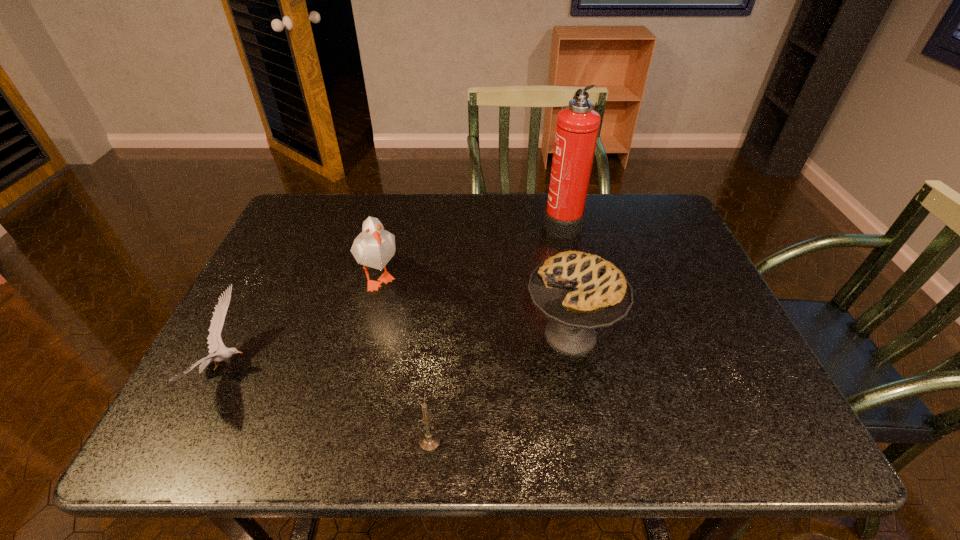
Locate an element on the screen. The width and height of the screenshot is (960, 540). free area in between the shorter gull and the farthest object is located at coordinates (394, 295).

At what (x,y) coordinates should I click in order to perform the action: click on blank region between the tallest object and the taller gull. Please return your answer as a coordinate pair (x, y). Image resolution: width=960 pixels, height=540 pixels. Looking at the image, I should click on (470, 249).

Locate an element on the screen. Image resolution: width=960 pixels, height=540 pixels. free space that is in between the third tallest object and the shorter gull is located at coordinates (398, 352).

The image size is (960, 540). What are the coordinates of `free spot between the right gull and the third object from left to right` in the screenshot? It's located at (404, 359).

I want to click on free area in between the nearest object and the fire extinguisher, so click(x=495, y=332).

Image resolution: width=960 pixels, height=540 pixels. Find the location of `free space between the third shortest object and the nearest object`. free space between the third shortest object and the nearest object is located at coordinates (500, 388).

Where is `empty space that is in between the candle and the shorter gull`? The height and width of the screenshot is (540, 960). empty space that is in between the candle and the shorter gull is located at coordinates (328, 404).

Locate an element on the screen. The width and height of the screenshot is (960, 540). free space between the shorter gull and the tallest object is located at coordinates (394, 295).

Find the location of a particular element. free space between the taller gull and the shorter gull is located at coordinates (302, 322).

Locate an element on the screen. Image resolution: width=960 pixels, height=540 pixels. object identified as the fourth closest to the pie is located at coordinates (214, 339).